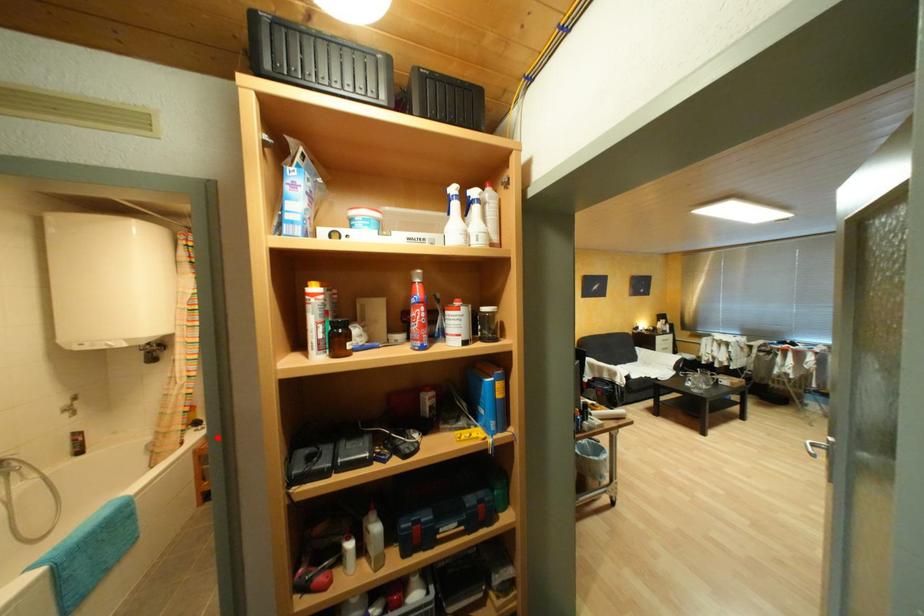
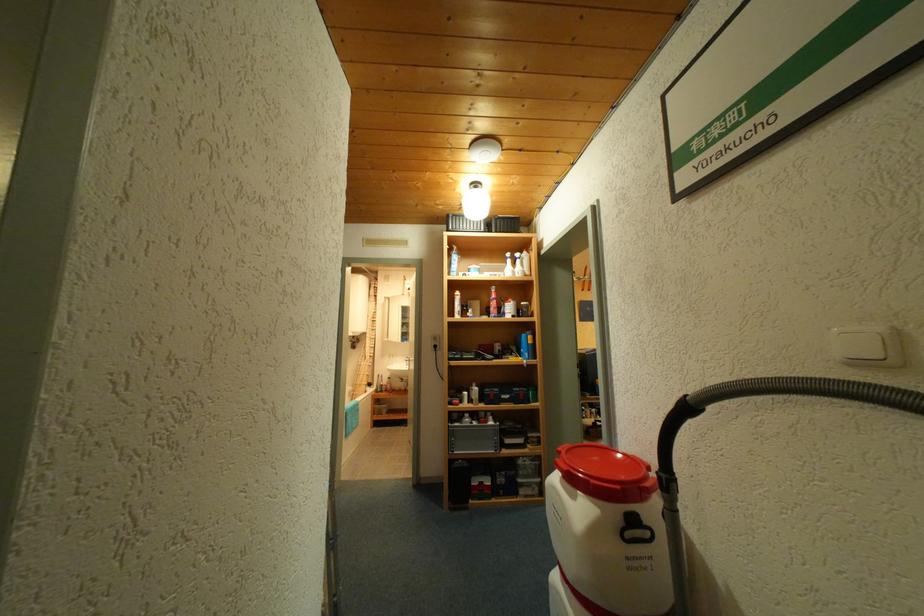
The point at the highlighted location is marked in the first image. Where is the corresponding point in the second image?

(385, 392)